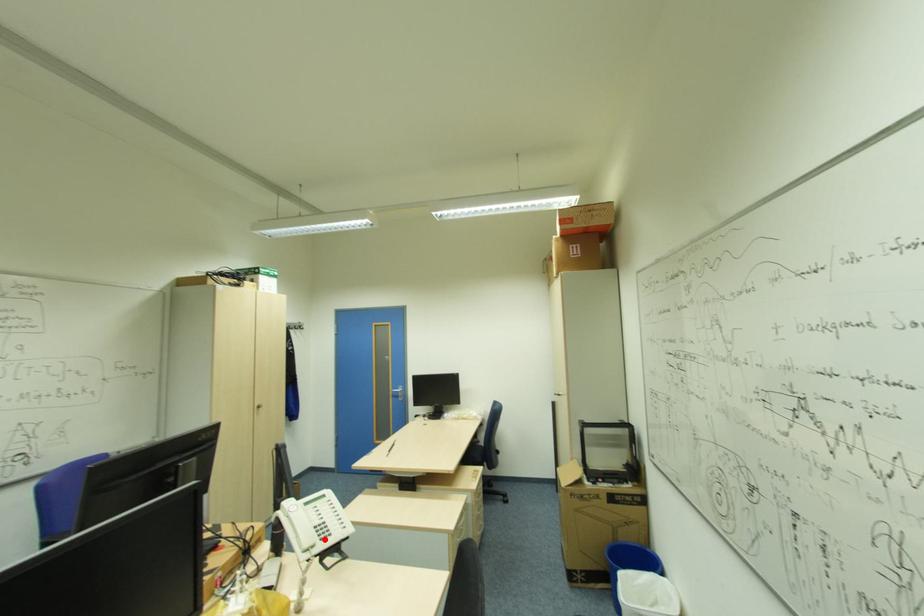
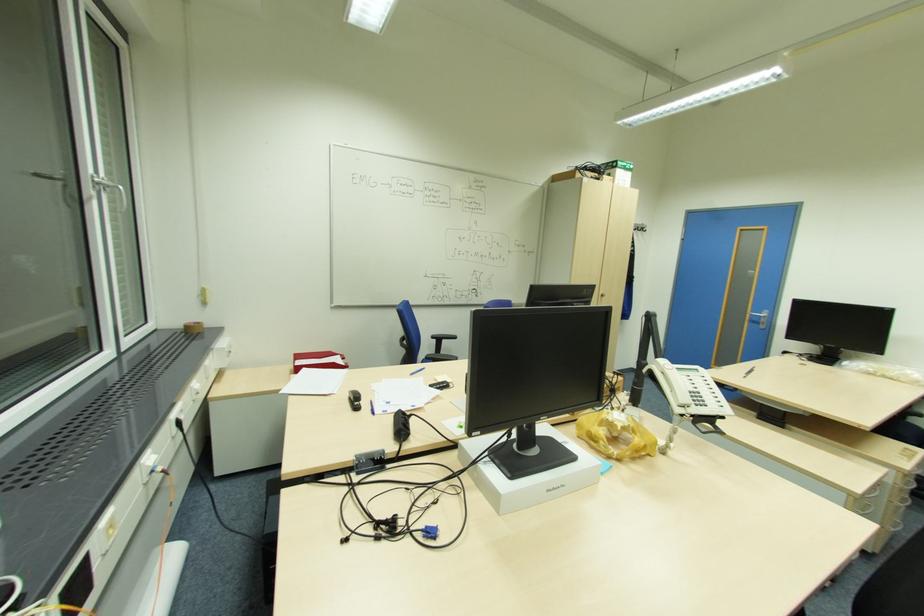
Question: I am providing you with two images of the same scene from different viewpoints. A red point is marked on the first image. Can you still see the location of the red point in image 2?

Choices:
 (A) Yes
 (B) No

Answer: (A)